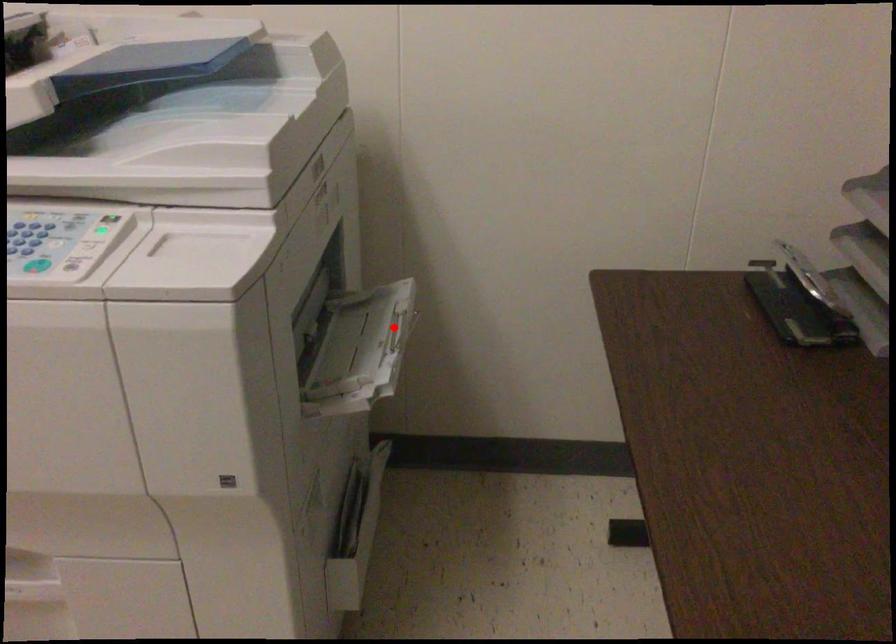
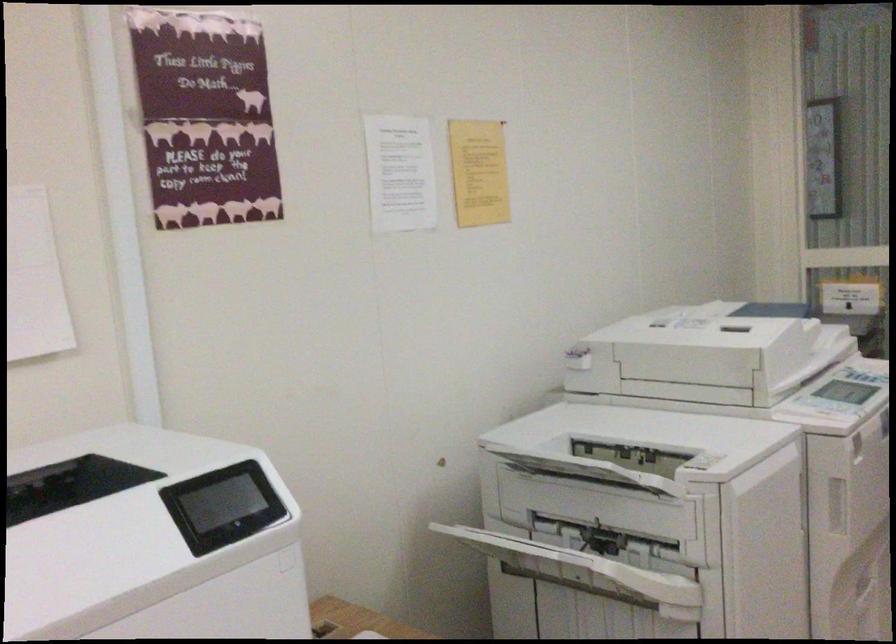
Question: I am providing you with two images of the same scene from different viewpoints. A red point is marked on the first image. Is the red point's position out of view in image 2?

Choices:
 (A) Yes
 (B) No

Answer: (A)